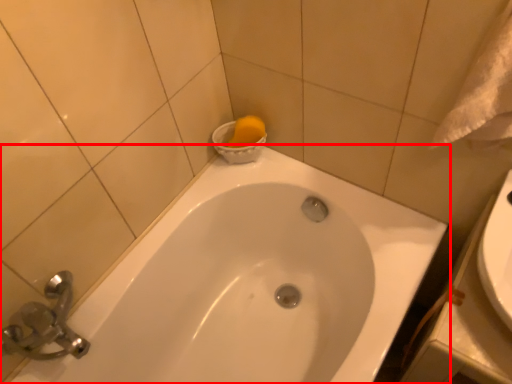
Question: From the image's perspective, where is bathtub (annotated by the red box) located in relation to bath towel in the image?

Choices:
 (A) above
 (B) below

Answer: (B)